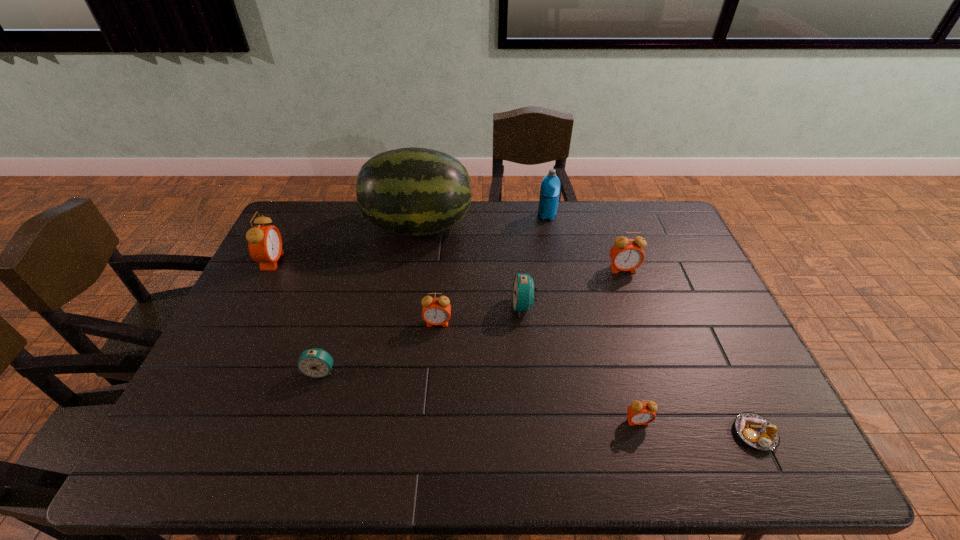
Where is `vacant space situated 0.370m on the face of the rightmost pink alarm clock`? The width and height of the screenshot is (960, 540). vacant space situated 0.370m on the face of the rightmost pink alarm clock is located at coordinates (659, 373).

The image size is (960, 540). What are the coordinates of `vacant space situated 0.400m on the front-facing side of the fourth alarm clock from left to right` in the screenshot? It's located at (377, 306).

At what (x,y) coordinates should I click in order to perform the action: click on vacant space located on the front-facing side of the fourth alarm clock from left to right. Please return your answer as a coordinate pair (x, y). This screenshot has height=540, width=960. Looking at the image, I should click on (394, 306).

Find the location of a particular element. vacant region located on the front-facing side of the fourth alarm clock from left to right is located at coordinates (411, 306).

At what (x,y) coordinates should I click in order to perform the action: click on free space located 0.140m on the face of the second smallest pink alarm clock. Please return your answer as a coordinate pair (x, y). The height and width of the screenshot is (540, 960). Looking at the image, I should click on (433, 370).

At what (x,y) coordinates should I click in order to perform the action: click on vacant space located 0.110m on the front-facing side of the seventh farthest object. Please return your answer as a coordinate pair (x, y). The width and height of the screenshot is (960, 540). Looking at the image, I should click on (305, 419).

Where is `vacant region located on the back of the pastry`? The height and width of the screenshot is (540, 960). vacant region located on the back of the pastry is located at coordinates 712,344.

Identify the location of watermelon situated at the far edge. (412, 191).

At what (x,y) coordinates should I click in order to perform the action: click on thermos bottle positioned at the far edge. Please return your answer as a coordinate pair (x, y). Looking at the image, I should click on (550, 186).

You are a GUI agent. You are given a task and a screenshot of the screen. Output one action in this format:
    pyautogui.click(x=<x>, y=<y>)
    Task: Click on the object that is at the near edge
    
    Given the screenshot: What is the action you would take?
    pyautogui.click(x=755, y=430)